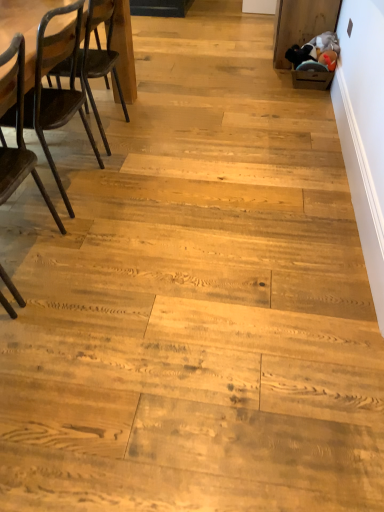
Identify the location of free space behind dark brown wood table at left. This screenshot has height=512, width=384. (131, 109).